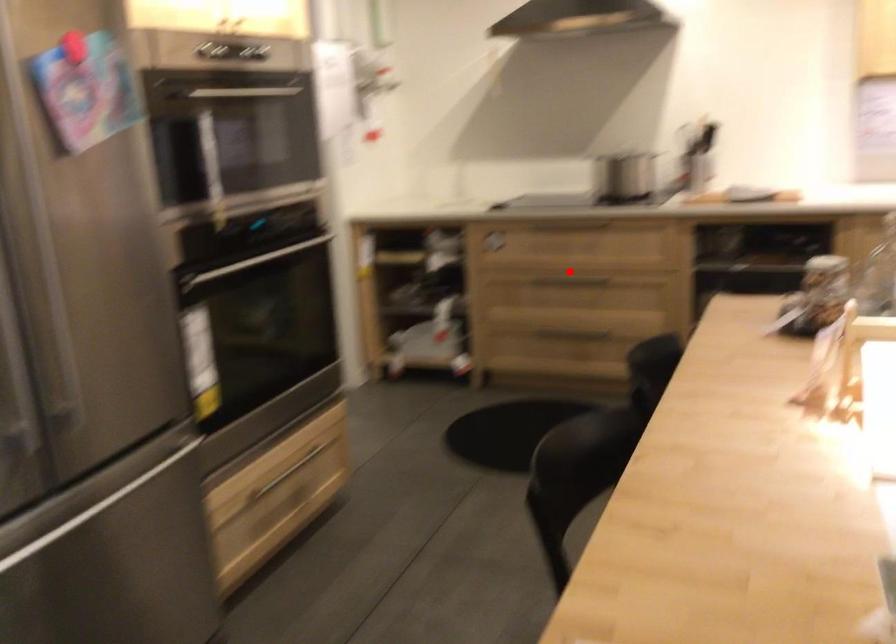
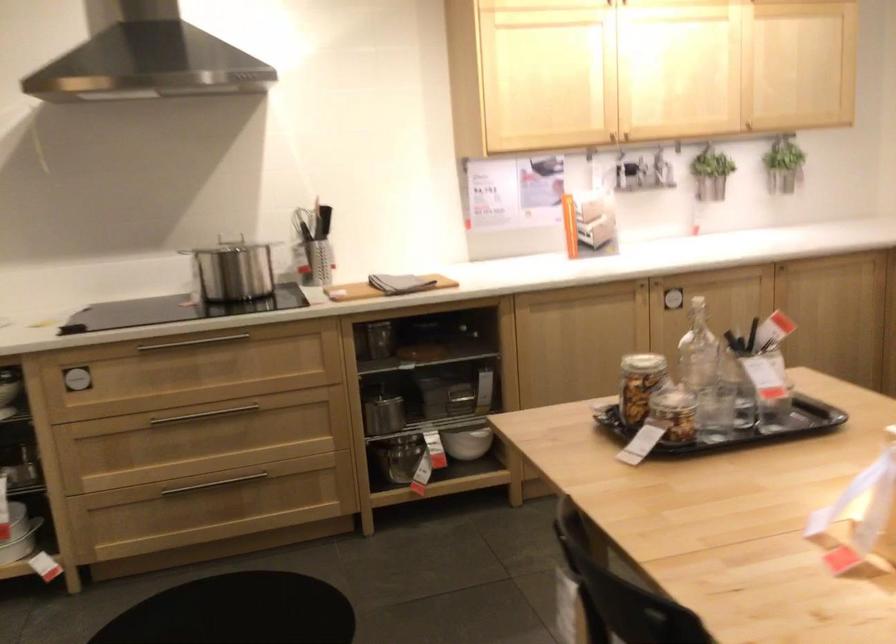
Question: I am providing you with two images of the same scene from different viewpoints. Given a red point in image1, look at the same physical point in image2. Is it:

Choices:
 (A) Closer to the viewpoint
 (B) Farther from the viewpoint

Answer: (A)